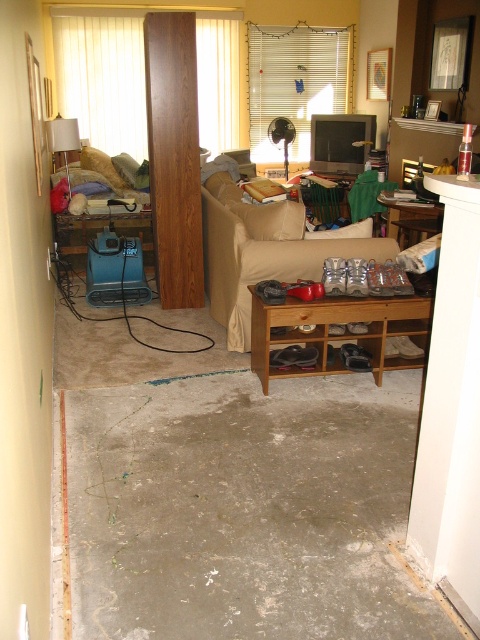
Looking at this image, who is lower down, beige fabric couch at center or wooden shoe rack at center?

wooden shoe rack at center is below.

The width and height of the screenshot is (480, 640). Describe the element at coordinates (264, 250) in the screenshot. I see `beige fabric couch at center` at that location.

Is point (226, 212) positioned before point (328, 369)?

No, it is behind (328, 369).

Image resolution: width=480 pixels, height=640 pixels. In order to click on beige fabric couch at center in this screenshot , I will do `click(264, 250)`.

Who is higher up, gray concrete floor at lower center or beige fabric couch at center?

beige fabric couch at center is higher up.

Between gray concrete floor at lower center and beige fabric couch at center, which one is positioned lower?

gray concrete floor at lower center is lower down.

Is point (369, 484) positioned before point (216, 252)?

That is True.

Where is `gray concrete floor at lower center`? gray concrete floor at lower center is located at coordinates (245, 509).

Does point (190, 113) come in front of point (70, 188)?

Yes, it is.

Does wooden pillar at center have a lesser width compared to matte white lampshade at upper left?

In fact, wooden pillar at center might be wider than matte white lampshade at upper left.

This screenshot has width=480, height=640. What are the coordinates of `wooden pillar at center` in the screenshot? It's located at (173, 156).